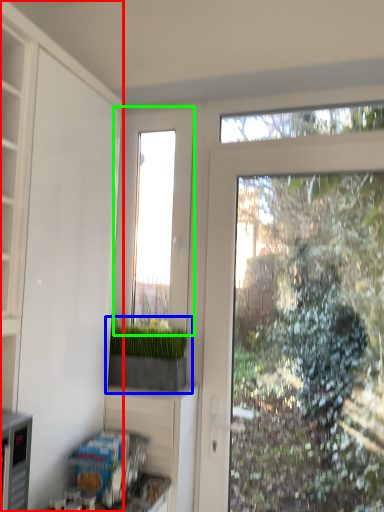
Question: Estimate the real-world distances between objects in this image. Which object is closer to cabinetry (highlighted by a red box), houseplant (highlighted by a blue box) or window (highlighted by a green box)?

Choices:
 (A) houseplant
 (B) window

Answer: (A)